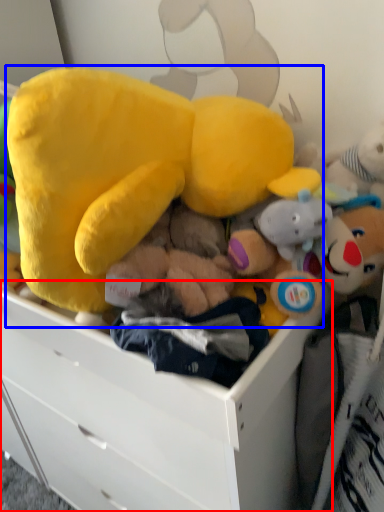
Question: Among these objects, which one is farthest to the camera, drawer (highlighted by a red box) or toy (highlighted by a blue box)?

Choices:
 (A) drawer
 (B) toy

Answer: (A)